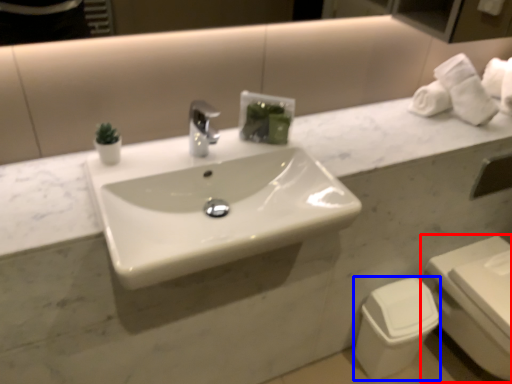
Question: Which point is closer to the camera, toilet (highlighted by a red box) or toilet bowl (highlighted by a blue box)?

Choices:
 (A) toilet
 (B) toilet bowl

Answer: (A)